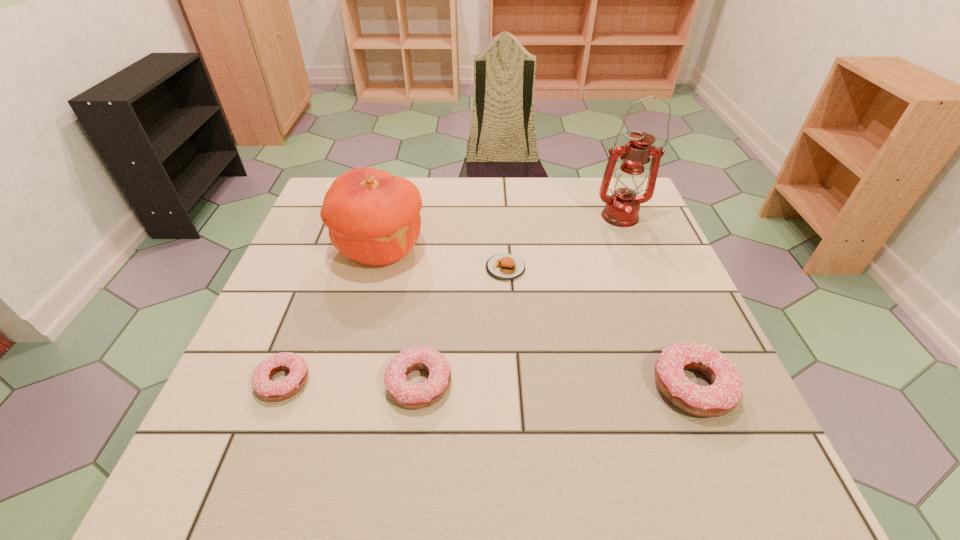
Where is `the leftmost doughnut`? the leftmost doughnut is located at coordinates (264, 388).

Identify the location of the second tallest doughnut. Image resolution: width=960 pixels, height=540 pixels. (412, 396).

In order to click on the third shortest object in this screenshot , I will do `click(412, 396)`.

Locate an element on the screen. the tallest doughnut is located at coordinates (722, 396).

The height and width of the screenshot is (540, 960). Identify the location of the rightmost doughnut. (722, 396).

Locate an element on the screen. This screenshot has height=540, width=960. oil lamp is located at coordinates (622, 208).

Find the location of `pumpkin`. pumpkin is located at coordinates (373, 217).

Where is `food`? The image size is (960, 540). food is located at coordinates (504, 266).

This screenshot has height=540, width=960. What are the coordinates of `vacant space located 0.350m on the right of the leftmost doughnut` in the screenshot? It's located at (493, 382).

Where is `free space located on the left of the second shortest doughnut`? The height and width of the screenshot is (540, 960). free space located on the left of the second shortest doughnut is located at coordinates (297, 383).